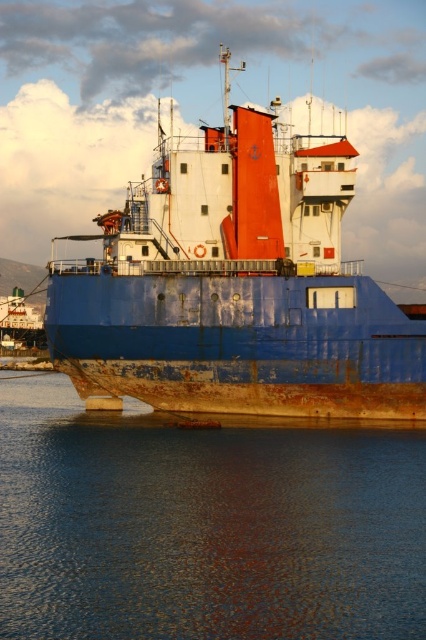
Question: Which object appears closest to the camera in this image?

Choices:
 (A) rusty metallic water at lower center
 (B) rusty metal ship at center

Answer: (A)

Question: Is rusty metallic water at lower center wider than rusty metal ship at center?

Choices:
 (A) no
 (B) yes

Answer: (A)

Question: Which of the following is the closest to the observer?

Choices:
 (A) rusty metallic water at lower center
 (B) rusty metal ship at center

Answer: (A)

Question: Does rusty metallic water at lower center appear over rusty metal ship at center?

Choices:
 (A) no
 (B) yes

Answer: (A)

Question: Considering the relative positions of rusty metallic water at lower center and rusty metal ship at center in the image provided, where is rusty metallic water at lower center located with respect to rusty metal ship at center?

Choices:
 (A) below
 (B) above

Answer: (A)